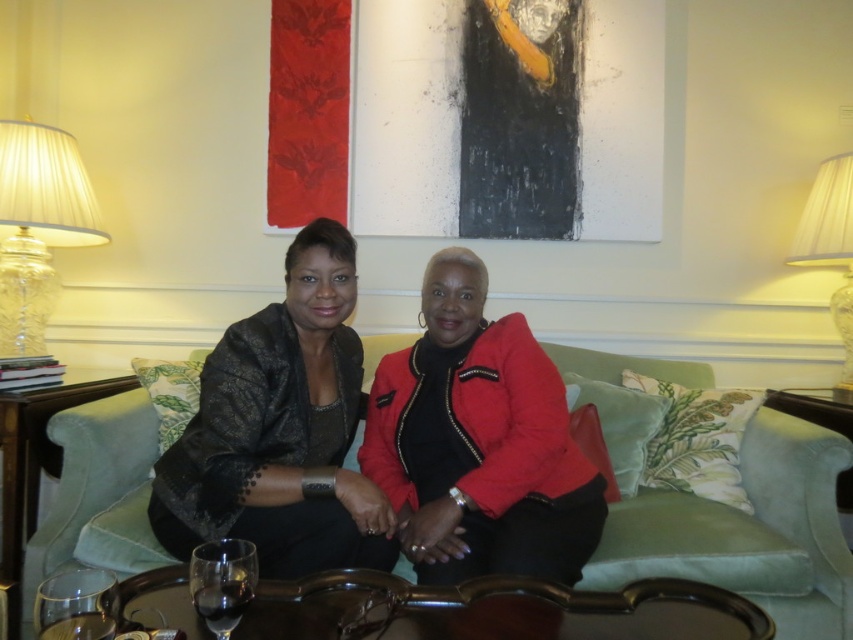
Is metallic black jacket at center above green velvet couch at center?

Yes.

Based on the photo, who is lower down, metallic black jacket at center or green velvet couch at center?

green velvet couch at center

At what (x,y) coordinates should I click in order to perform the action: click on metallic black jacket at center. Please return your answer as a coordinate pair (x, y). Looking at the image, I should click on (352, 436).

The width and height of the screenshot is (853, 640). In order to click on metallic black jacket at center in this screenshot , I will do `click(352, 436)`.

Looking at this image, does metallic black jacket at center appear on the right side of brown polished wood table at lower center?

In fact, metallic black jacket at center is to the left of brown polished wood table at lower center.

Does point (461, 525) come behind point (387, 602)?

Yes, it is.

Is point (381, 563) positioned before point (128, 586)?

No.

Image resolution: width=853 pixels, height=640 pixels. Find the location of `metallic black jacket at center`. metallic black jacket at center is located at coordinates (352, 436).

Between point (44, 465) and point (76, 589), which one is positioned behind?

Positioned behind is point (44, 465).

Can you confirm if wooden table at lower left is taller than transparent glass at lower left?

Indeed, wooden table at lower left has a greater height compared to transparent glass at lower left.

Where is `wooden table at lower left`? The height and width of the screenshot is (640, 853). wooden table at lower left is located at coordinates (35, 465).